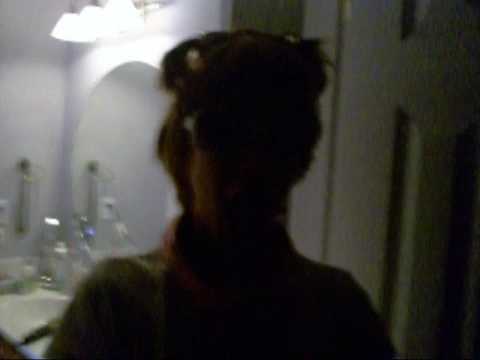
Where is `sink`? sink is located at coordinates (35, 309).